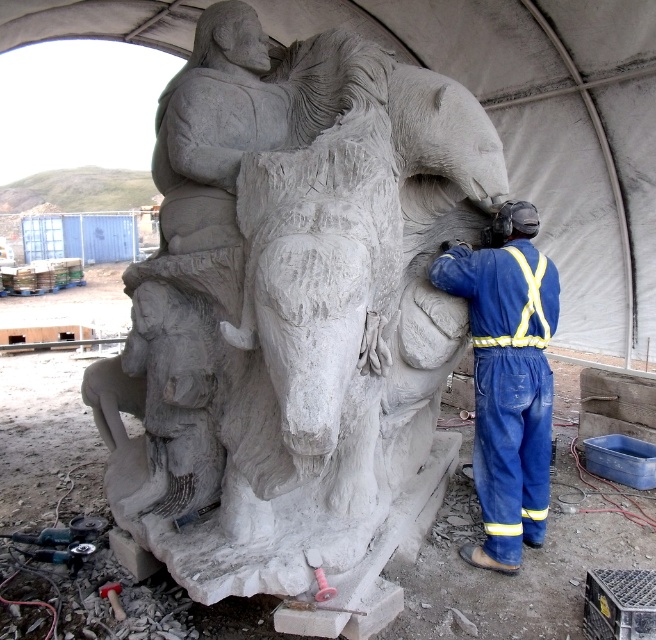
Question: Is white stone horse at center above blue fabric jumpsuit at right?

Choices:
 (A) no
 (B) yes

Answer: (B)

Question: Which object is closer to the camera taking this photo?

Choices:
 (A) white stone horse at center
 (B) blue fabric jumpsuit at right

Answer: (A)

Question: Can you confirm if white stone horse at center is positioned below blue fabric jumpsuit at right?

Choices:
 (A) yes
 (B) no

Answer: (B)

Question: Can you confirm if white stone horse at center is positioned above blue fabric jumpsuit at right?

Choices:
 (A) yes
 (B) no

Answer: (A)

Question: Among these points, which one is farthest from the camera?

Choices:
 (A) (525, 538)
 (B) (367, 422)

Answer: (A)

Question: Which of the following is the farthest from the observer?

Choices:
 (A) (483, 256)
 (B) (379, 266)

Answer: (A)